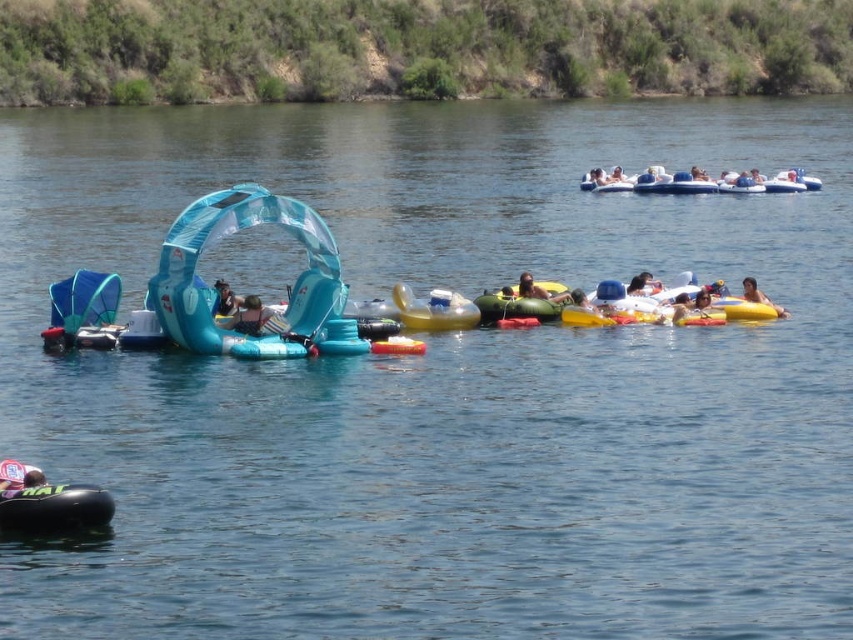
You are planning to take a photo of the green rubber raft at center and the matte blue inflatable at center from the riverbank. Which object should you focus on first if you want to capture both in one shot without moving the camera?

→ You should focus on the matte blue inflatable at center first because it is closer to the camera than the green rubber raft at center, which is positioned to its right.